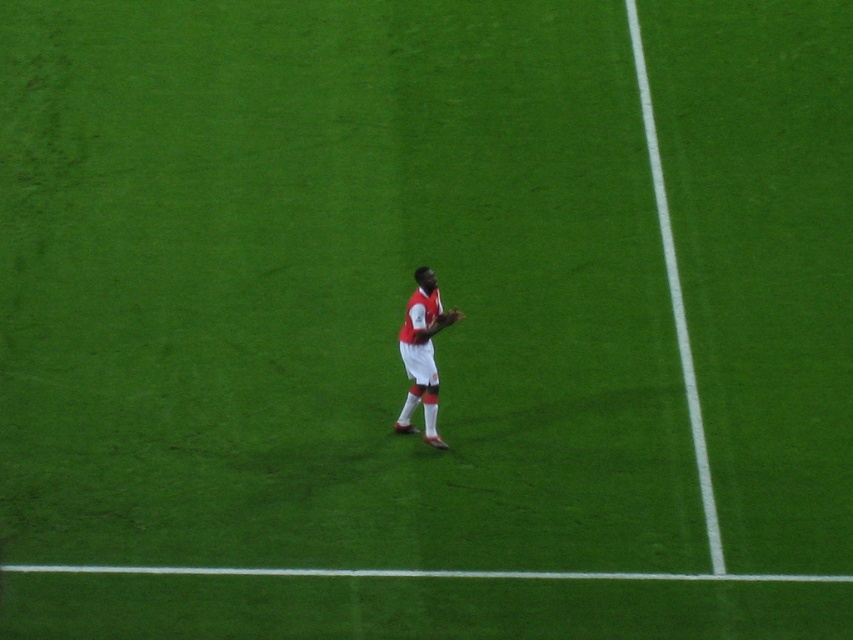
Who is positioned more to the left, white matte soccer player at center or brown leather glove at center?

white matte soccer player at center

Is white matte soccer player at center in front of brown leather glove at center?

That is True.

The image size is (853, 640). Find the location of `white matte soccer player at center`. white matte soccer player at center is located at coordinates (421, 355).

What are the coordinates of `white matte soccer player at center` in the screenshot? It's located at (421, 355).